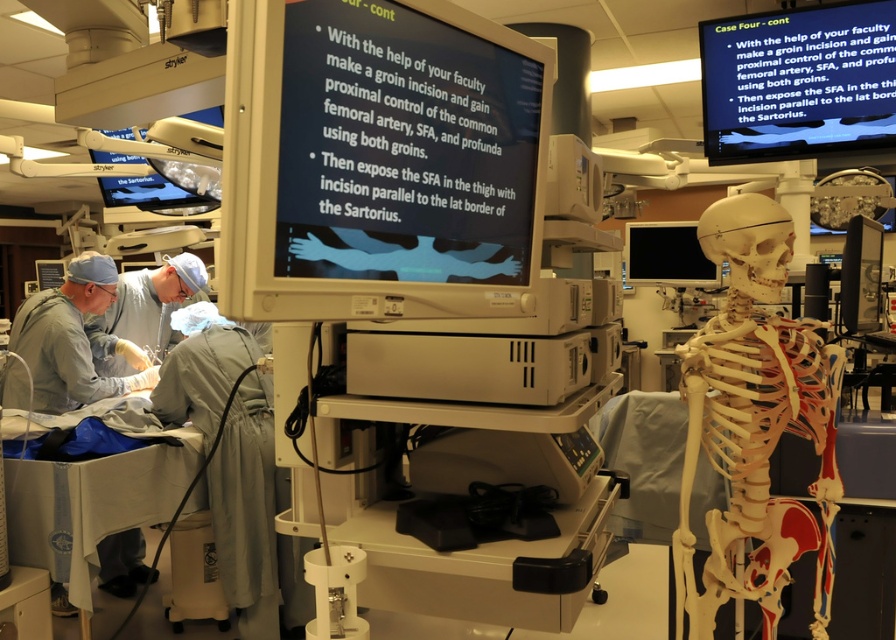
Describe the element at coordinates (378, 161) in the screenshot. The height and width of the screenshot is (640, 896). I see `matte plastic monitor at center` at that location.

The image size is (896, 640). Describe the element at coordinates (378, 161) in the screenshot. I see `matte plastic monitor at center` at that location.

Find the location of a particular element. This screenshot has height=640, width=896. matte plastic monitor at center is located at coordinates (378, 161).

In the scene shown: Who is more forward, (345, 129) or (37, 397)?

Positioned in front is point (345, 129).

Is matte plastic monitor at center bigger than gray matte surgical gown at left?

Incorrect, matte plastic monitor at center is not larger than gray matte surgical gown at left.

Does point (334, 176) lie in front of point (100, 296)?

Yes.

What are the coordinates of `matte plastic monitor at center` in the screenshot? It's located at (378, 161).

Can you confirm if gray matte surgical gown at left is smaller than black glossy monitor at center?

Actually, gray matte surgical gown at left might be larger than black glossy monitor at center.

Can you confirm if gray matte surgical gown at left is taller than black glossy monitor at center?

Yes, gray matte surgical gown at left is taller than black glossy monitor at center.

Does point (16, 371) come farther from viewer compared to point (694, 276)?

No, it is not.

Find the location of `gray matte surgical gown at left`. gray matte surgical gown at left is located at coordinates (67, 342).